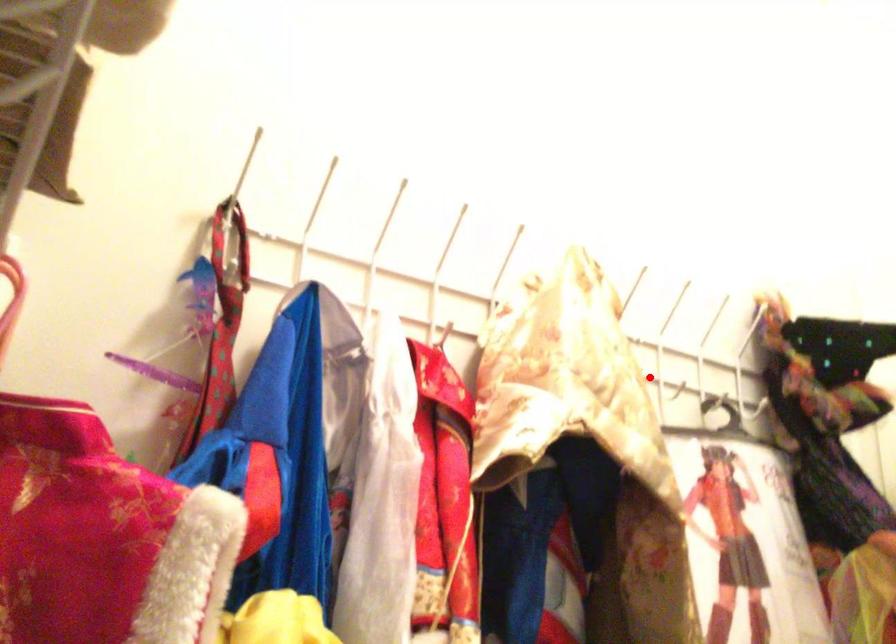
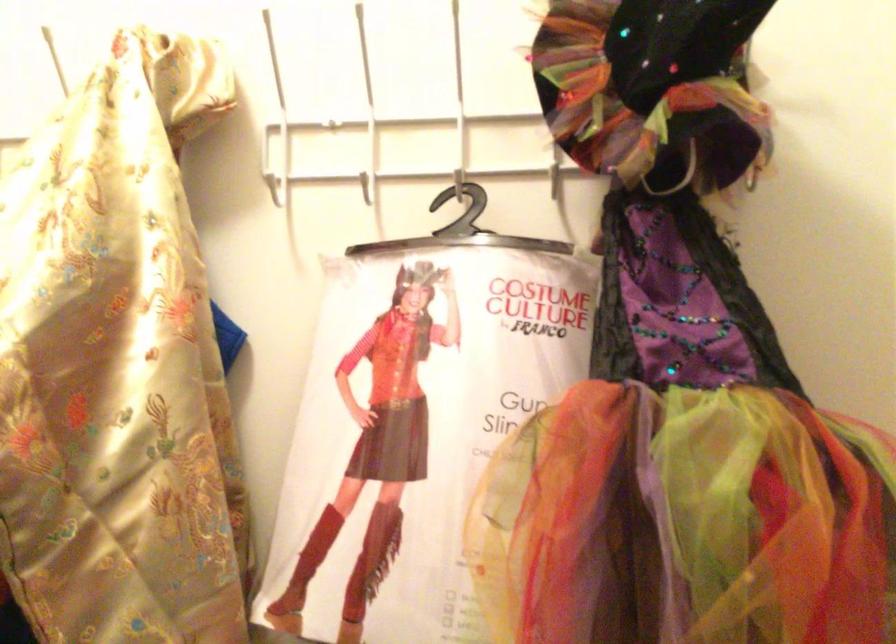
Where in the second image is the point corresponding to the highlighted location from the first image?

(366, 187)